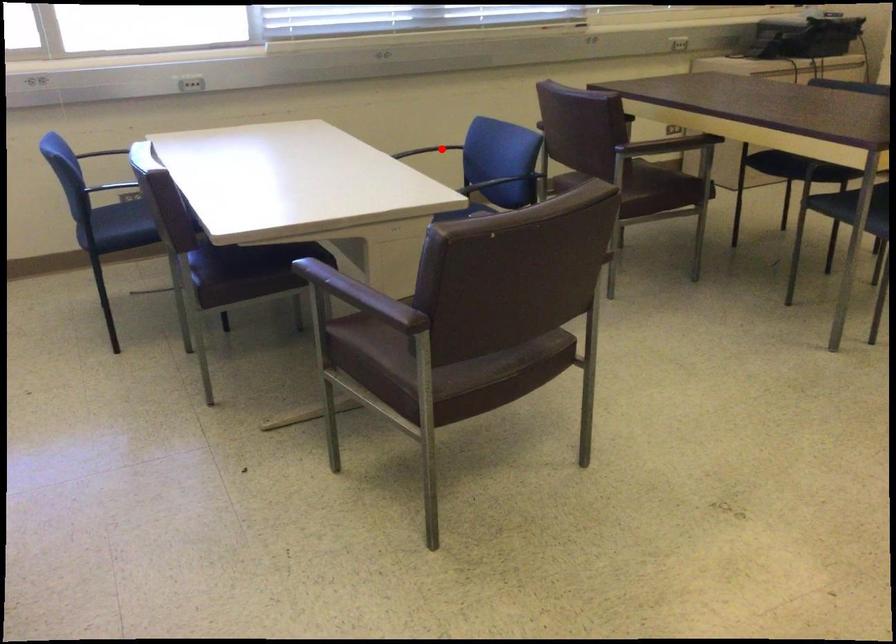
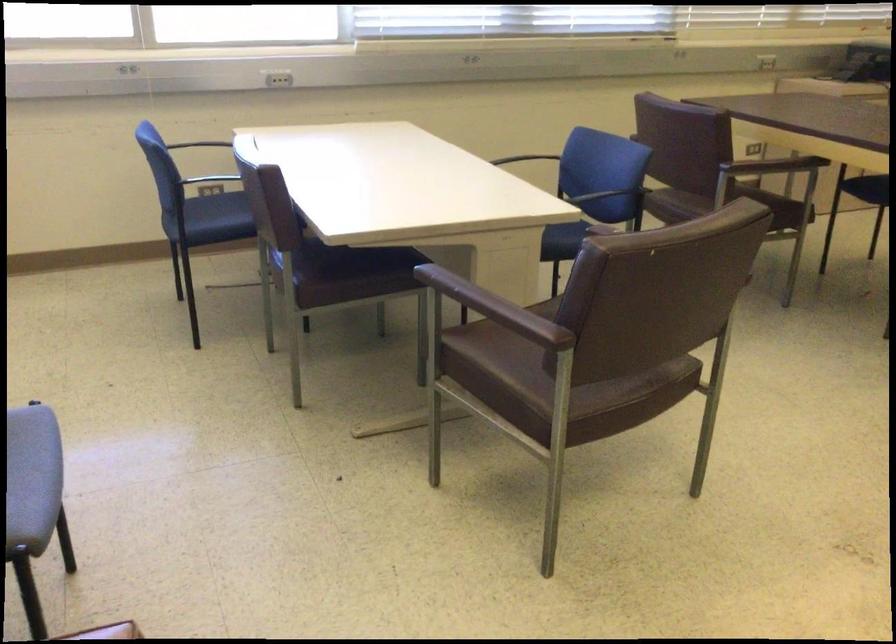
In the second image, find the point that corresponds to the highlighted location in the first image.

(521, 158)